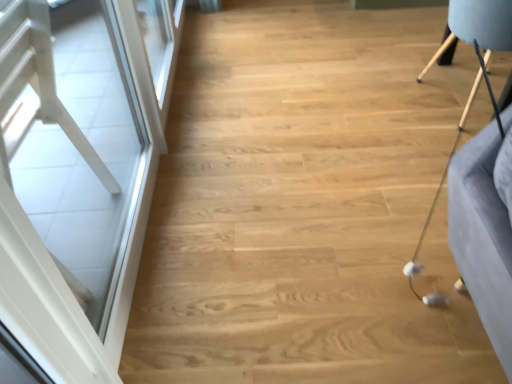
You are a GUI agent. You are given a task and a screenshot of the screen. Output one action in this format:
    pyautogui.click(x=<x>, y=<y>)
    Task: Click on the light brown wooden chair at upper right
    The height and width of the screenshot is (384, 512).
    Given the screenshot: What is the action you would take?
    pyautogui.click(x=477, y=27)

What is the approximate height of light brown wooden chair at upper right?

The height of light brown wooden chair at upper right is 64.88 centimeters.

Describe the element at coordinates (477, 27) in the screenshot. This screenshot has width=512, height=384. I see `light brown wooden chair at upper right` at that location.

The image size is (512, 384). Find the location of `white glossy screen door at left`. white glossy screen door at left is located at coordinates (75, 179).

What do you see at coordinates (75, 179) in the screenshot?
I see `white glossy screen door at left` at bounding box center [75, 179].

The height and width of the screenshot is (384, 512). Find the location of `light brown wooden chair at upper right`. light brown wooden chair at upper right is located at coordinates (477, 27).

Is light brown wooden chair at upper right to the left of white glossy screen door at left from the viewer's perspective?

No.

Considering their positions, is light brown wooden chair at upper right located in front of or behind white glossy screen door at left?

Visually, light brown wooden chair at upper right is located behind white glossy screen door at left.

Which is behind, point (504, 4) or point (9, 194)?

The point (504, 4) is behind.

From the image's perspective, is light brown wooden chair at upper right located above or below white glossy screen door at left?

Clearly, from the image's perspective, light brown wooden chair at upper right is above white glossy screen door at left.

From a real-world perspective, does light brown wooden chair at upper right sit lower than white glossy screen door at left?

Yes, from a real-world perspective, light brown wooden chair at upper right is below white glossy screen door at left.

Looking at their sizes, would you say light brown wooden chair at upper right is wider or thinner than white glossy screen door at left?

light brown wooden chair at upper right is wider than white glossy screen door at left.

Which of these two, light brown wooden chair at upper right or white glossy screen door at left, stands shorter?

Standing shorter between the two is light brown wooden chair at upper right.

In terms of size, does light brown wooden chair at upper right appear bigger or smaller than white glossy screen door at left?

In the image, light brown wooden chair at upper right appears to be larger than white glossy screen door at left.

Can we say light brown wooden chair at upper right lies outside white glossy screen door at left?

Yes, light brown wooden chair at upper right is not within white glossy screen door at left.

Is there a large distance between light brown wooden chair at upper right and white glossy screen door at left?

Yes.

Is light brown wooden chair at upper right facing away from white glossy screen door at left?

That's right, light brown wooden chair at upper right is facing away from white glossy screen door at left.

What's the angular difference between light brown wooden chair at upper right and white glossy screen door at left's facing directions?

They differ by 7.03 degrees in their facing directions.

This screenshot has width=512, height=384. Identify the location of furniture that is above the white glossy screen door at left (from the image's perspective). (477, 27).

Visually, is white glossy screen door at left positioned to the left or to the right of light brown wooden chair at upper right?

Based on their positions, white glossy screen door at left is located to the left of light brown wooden chair at upper right.

Considering the relative positions of white glossy screen door at left and light brown wooden chair at upper right in the image provided, is white glossy screen door at left in front of light brown wooden chair at upper right?

That is True.

Considering the points (163, 88) and (500, 13), which point is in front, point (163, 88) or point (500, 13)?

The point (500, 13) is closer to the camera.

From the image's perspective, which is below, white glossy screen door at left or light brown wooden chair at upper right?

white glossy screen door at left is shown below in the image.

From a real-world perspective, between white glossy screen door at left and light brown wooden chair at upper right, who is vertically lower?

In real-world perspective, light brown wooden chair at upper right is lower.

Considering the sizes of objects white glossy screen door at left and light brown wooden chair at upper right in the image provided, who is thinner, white glossy screen door at left or light brown wooden chair at upper right?

Thinner between the two is white glossy screen door at left.

Does white glossy screen door at left have a lesser height compared to light brown wooden chair at upper right?

No.

Between white glossy screen door at left and light brown wooden chair at upper right, which one has larger size?

light brown wooden chair at upper right is bigger.

Is light brown wooden chair at upper right a part of white glossy screen door at left?

No, light brown wooden chair at upper right is not surrounded by white glossy screen door at left.

Is white glossy screen door at left not close to light brown wooden chair at upper right?

That's right, there is a large distance between white glossy screen door at left and light brown wooden chair at upper right.

Is white glossy screen door at left looking in the opposite direction of light brown wooden chair at upper right?

No, white glossy screen door at left's orientation is not away from light brown wooden chair at upper right.

How much distance is there between white glossy screen door at left and light brown wooden chair at upper right?

white glossy screen door at left and light brown wooden chair at upper right are 6.70 feet apart.

Where is `furniture below the white glossy screen door at left (from a real-world perspective)`? furniture below the white glossy screen door at left (from a real-world perspective) is located at coordinates (477, 27).

The image size is (512, 384). In order to click on furniture on the right of white glossy screen door at left in this screenshot , I will do `click(477, 27)`.

Where is `furniture below the white glossy screen door at left (from a real-world perspective)`? The height and width of the screenshot is (384, 512). furniture below the white glossy screen door at left (from a real-world perspective) is located at coordinates (477, 27).